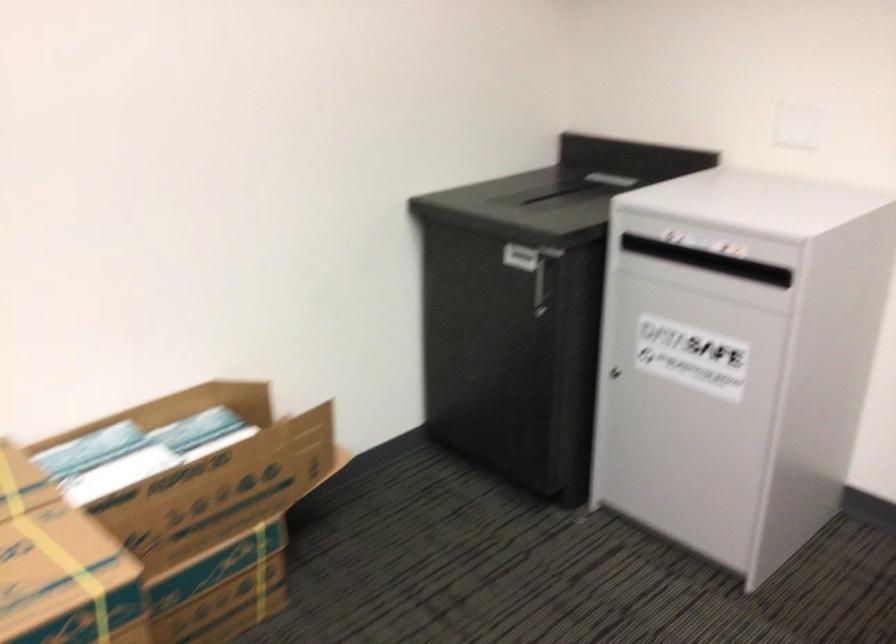
This screenshot has height=644, width=896. What are the coordinates of `metal bin latch` in the screenshot? It's located at (541, 281).